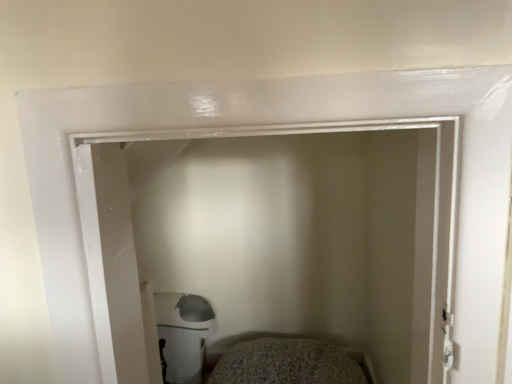
You are a GUI agent. You are given a task and a screenshot of the screen. Output one action in this format:
    pyautogui.click(x=<x>, y=<y>)
    Task: Click on the white painted wood door frame at center
    The image size is (512, 384).
    Given the screenshot: What is the action you would take?
    pyautogui.click(x=270, y=245)

Image resolution: width=512 pixels, height=384 pixels. What do you see at coordinates (270, 245) in the screenshot?
I see `white painted wood door frame at center` at bounding box center [270, 245].

This screenshot has height=384, width=512. I want to click on white painted wood door frame at center, so click(270, 245).